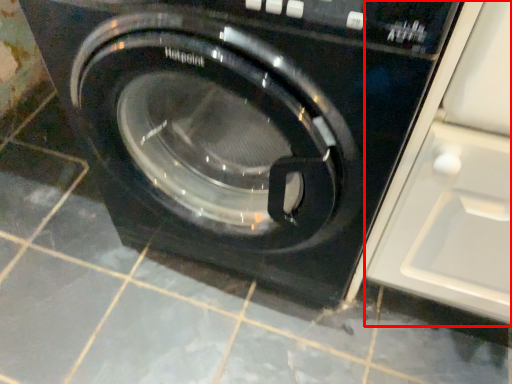
Question: From the image's perspective, considering the relative positions of glass door (annotated by the red box) and washing machine in the image provided, where is glass door (annotated by the red box) located with respect to the staircase?

Choices:
 (A) above
 (B) below

Answer: (B)